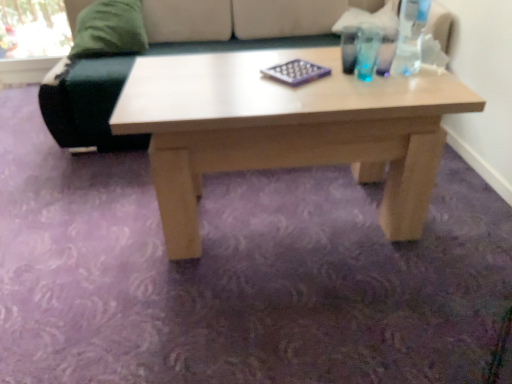
Question: Based on their sizes in the image, would you say green fabric pillow at upper left is bigger or smaller than purple matte chessboard at center?

Choices:
 (A) small
 (B) big

Answer: (B)

Question: Is point (144, 44) closer or farther from the camera than point (288, 77)?

Choices:
 (A) farther
 (B) closer

Answer: (A)

Question: Which object is positioned farthest from the green fabric pillow at upper left?

Choices:
 (A) velvet green couch at upper left
 (B) transparent plastic bottle at upper right
 (C) purple matte chessboard at center

Answer: (B)

Question: Estimate the real-world distances between objects in this image. Which object is closer to the purple matte chessboard at center?

Choices:
 (A) velvet green couch at upper left
 (B) transparent plastic bottle at upper right
 (C) green fabric pillow at upper left

Answer: (B)